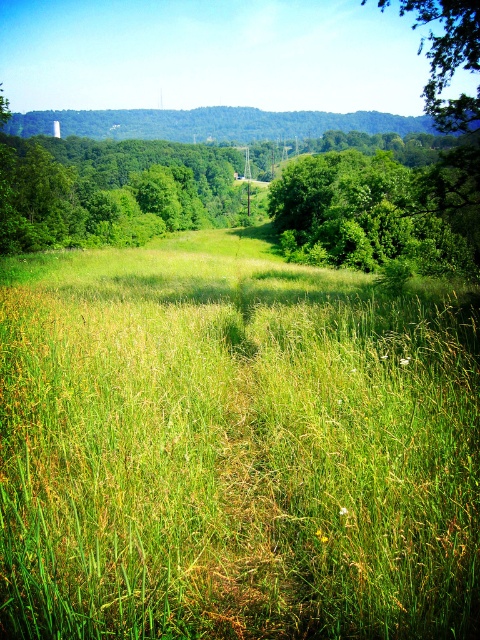
You are standing at the origin point in the image. Where is the green grassy field at center located?

The green grassy field at center is located at point 0.702 in the x coordinate and 0.487 in the y coordinate.

You are standing in the middle of the green grassy field at center and want to walk to the green leafy tree at center. In which direction should you head?

You should head to the right to reach the green leafy tree at center because the green grassy field at center is to the left of the green leafy tree at center.

In the scene shown: You are a gardener planning to mow the green grassy field at center and trim the green leafy tree at center. Which area requires more horizontal space to work around?

The green grassy field at center might be wider than the green leafy tree at center, so the gardener should allocate more horizontal space for the green grassy field at center.